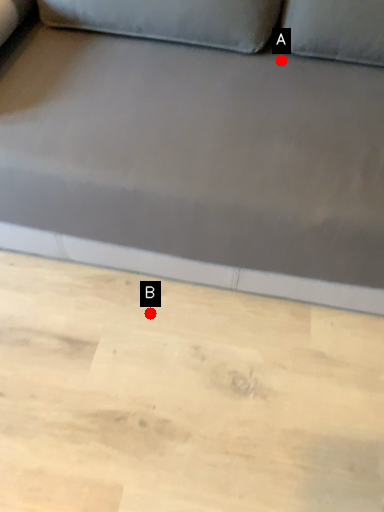
Question: Two points are circled on the image, labeled by A and B beside each circle. Among these points, which one is nearest to the camera?

Choices:
 (A) A is closer
 (B) B is closer

Answer: (A)